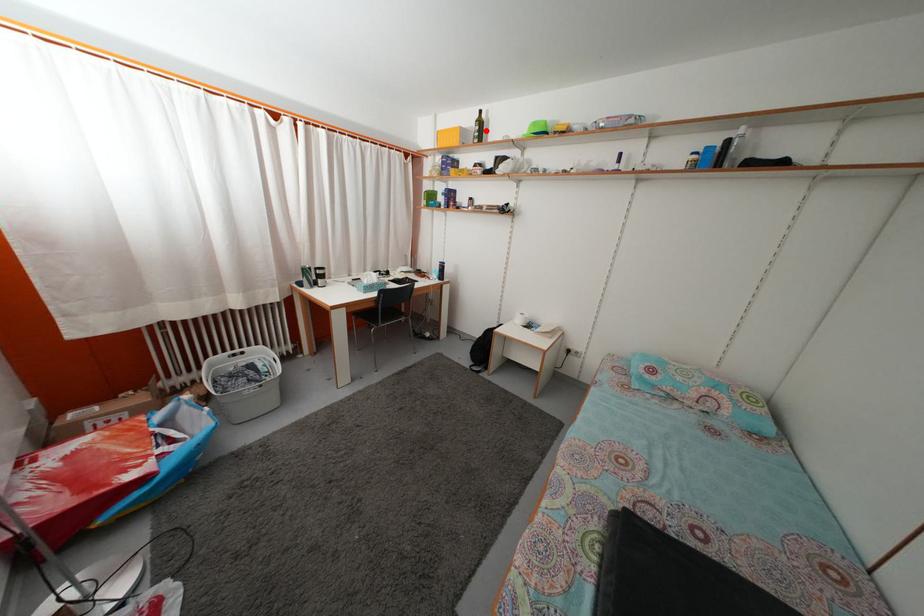
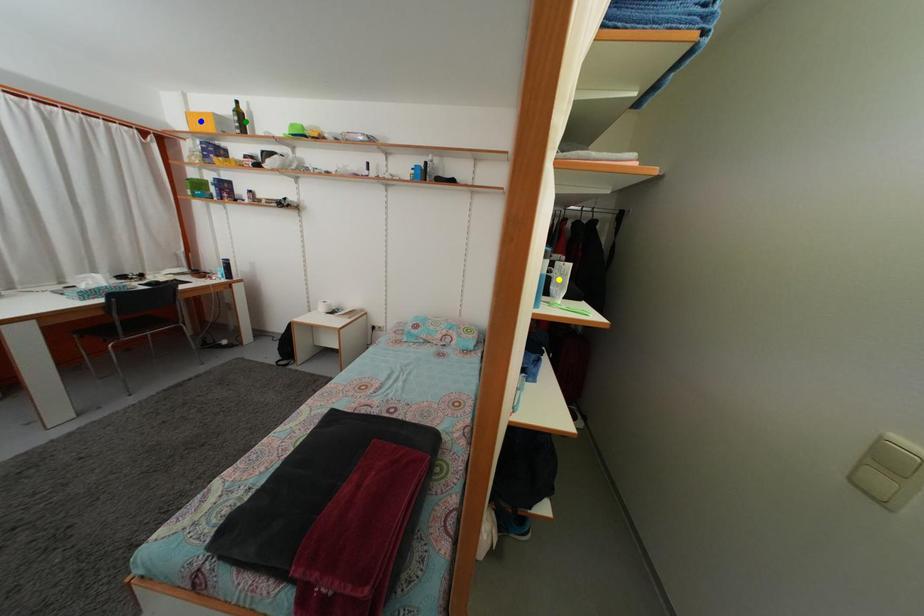
Question: I am providing you with two images of the same scene from different viewpoints. A red point is marked on the first image. You are given multiple points on the second image. Which spot in image 2 lines up with the point in image 1?

Choices:
 (A) blue point
 (B) yellow point
 (C) green point

Answer: (C)